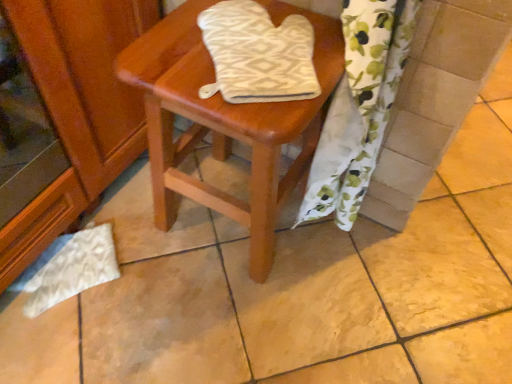
I want to click on vacant area situated below white floral fabric at lower right (from a real-world perspective), so click(320, 238).